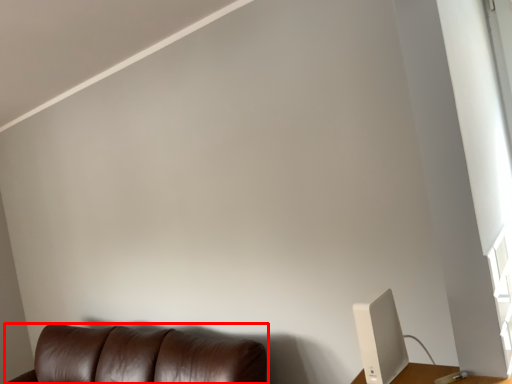
Question: From the image's perspective, what is the correct spatial positioning of furniture (annotated by the red box) in reference to computer monitor?

Choices:
 (A) above
 (B) below

Answer: (B)